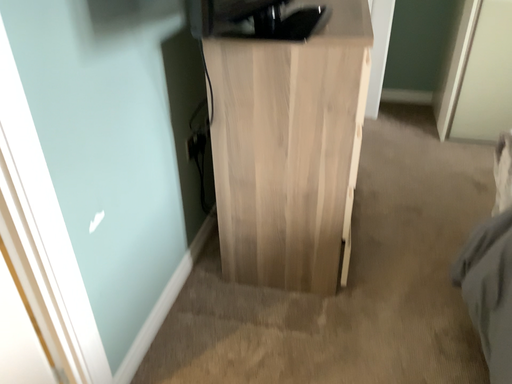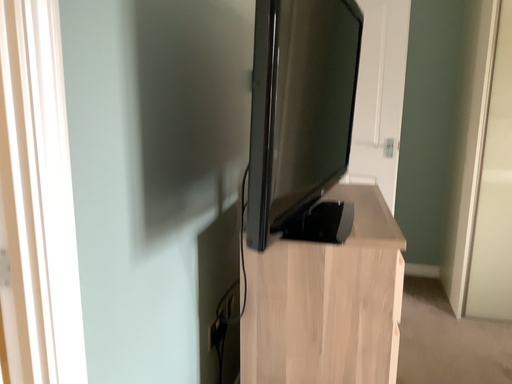
Question: Which way did the camera rotate in the video?

Choices:
 (A) rotated downward
 (B) rotated upward

Answer: (B)